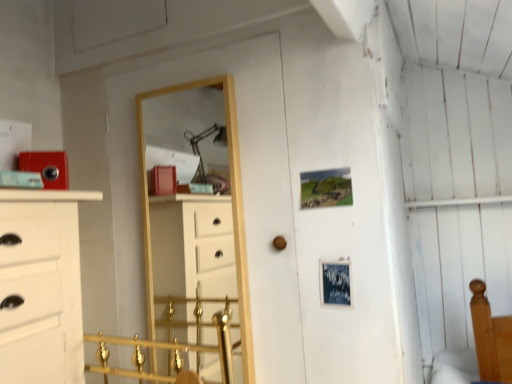
Question: From a real-world perspective, is brown matte door handle at center physically located above or below gold wooden mirror at center?

Choices:
 (A) above
 (B) below

Answer: (B)

Question: Is brown matte door handle at center spatially inside gold wooden mirror at center, or outside of it?

Choices:
 (A) outside
 (B) inside

Answer: (A)

Question: Is point (280, 235) closer or farther from the camera than point (248, 316)?

Choices:
 (A) farther
 (B) closer

Answer: (B)

Question: From a real-world perspective, is gold wooden mirror at center above or below brown matte door handle at center?

Choices:
 (A) above
 (B) below

Answer: (A)

Question: Would you say gold wooden mirror at center is to the left or to the right of brown matte door handle at center in the picture?

Choices:
 (A) right
 (B) left

Answer: (B)

Question: Is point (242, 329) closer or farther from the camera than point (274, 241)?

Choices:
 (A) closer
 (B) farther

Answer: (A)

Question: Looking at the image, does gold wooden mirror at center seem bigger or smaller compared to brown matte door handle at center?

Choices:
 (A) small
 (B) big

Answer: (B)